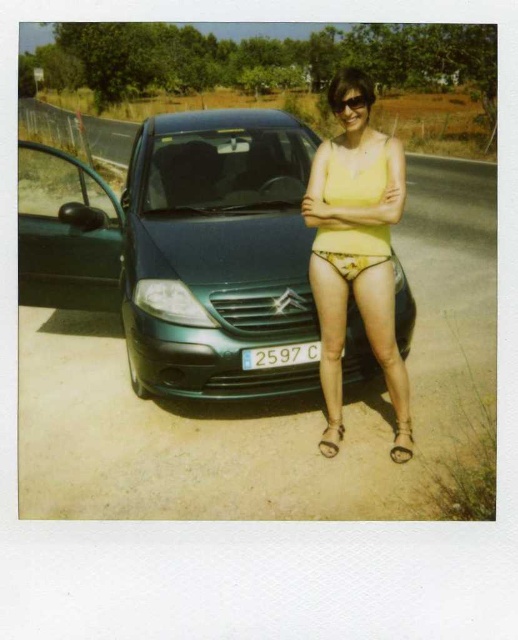
You are a photographer trying to capture a closeup shot of the white plastic license plate at center and the brown leather sandal at lower right. Which object should you zoom in on first if you want to focus on the one that is smaller in height?

The white plastic license plate at center has a lesser height compared to the brown leather sandal at lower right, so you should zoom in on the white plastic license plate at center first to focus on the smaller object.

You are standing at the point with coordinates point (266, 356) and want to walk to the point with coordinates point (365, 285). According to the image, will you be moving towards the car or away from it?

Point (365, 285) is in front of point (266, 356). Therefore, moving from point (266, 356) to point (365, 285) means you are moving towards the car.

You are a photographer standing at the edge of the road where the Citroen car is parked. You want to take a photo of the yellow matte tank top at center from a distance of exactly 3 meters. Is it possible to do so without moving the subject?

The yellow matte tank top at center and viewer are 3.19 meters apart, so the photographer can position themselves slightly closer to reduce the distance to exactly 3 meters and take the photo without moving the subject.